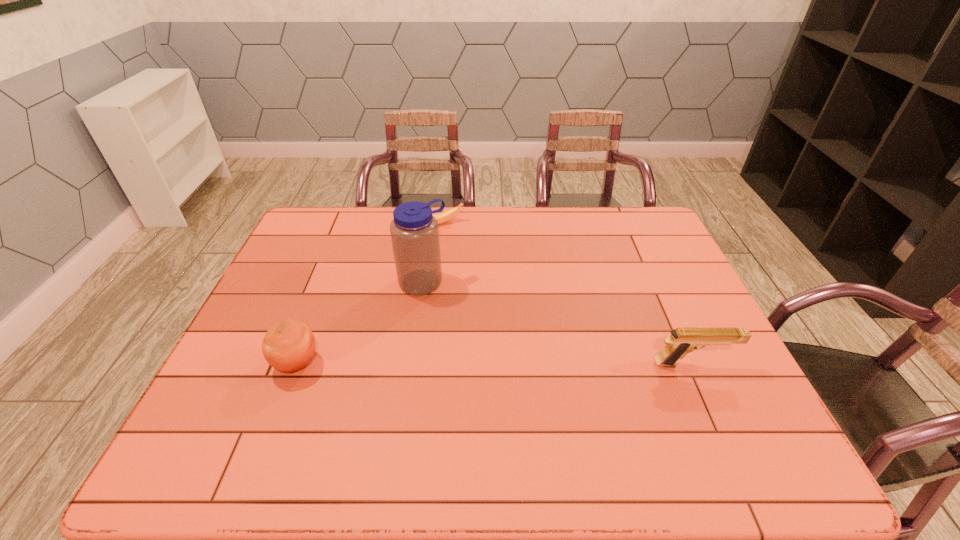
Find the location of a particular element. free region located 0.360m with a carrying loop on the side of the tallest object is located at coordinates (506, 383).

At what (x,y) coordinates should I click in order to perform the action: click on free spot located 0.260m with a carrying loop on the side of the tallest object. Please return your answer as a coordinate pair (x, y). This screenshot has height=540, width=960. Looking at the image, I should click on (483, 355).

Locate an element on the screen. This screenshot has height=540, width=960. free space located 0.360m with a carrying loop on the side of the tallest object is located at coordinates (506, 383).

Locate an element on the screen. The width and height of the screenshot is (960, 540). object that is at the far edge is located at coordinates (443, 217).

I want to click on object located in the left edge section of the desktop, so click(x=288, y=346).

Where is `object that is at the right edge`? object that is at the right edge is located at coordinates (683, 340).

The height and width of the screenshot is (540, 960). In the image, there is a desktop. Identify the location of blank space at the far edge. (355, 211).

Identify the location of free location at the near edge. This screenshot has width=960, height=540. (521, 396).

Identify the location of vacant space at the left edge of the desktop. Image resolution: width=960 pixels, height=540 pixels. click(x=311, y=314).

Locate an element on the screen. This screenshot has height=540, width=960. free region at the right edge of the desktop is located at coordinates coord(707,313).